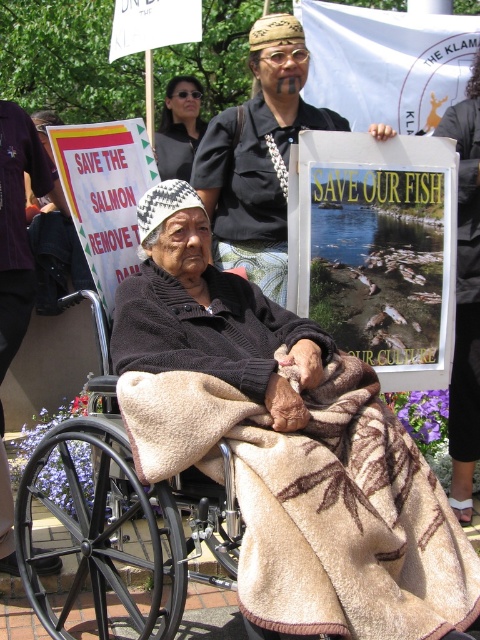
From the picture: You are a photographer trying to capture a closeup of the matte black sunglasses at upper center without including the black metal wheelchair at lower left in the frame. Is the wheelchair positioned in a way that could block your shot?

The black metal wheelchair at lower left might be wider than matte black sunglasses at upper center, so there is a possibility that the wheelchair could block the shot depending on the angle and distance.

Based on the scene description, can you determine the spatial relationship between the beige woolen blanket at center and the matte black sunglasses at upper center?

The beige woolen blanket at center is positioned on the right side of matte black sunglasses at upper center.